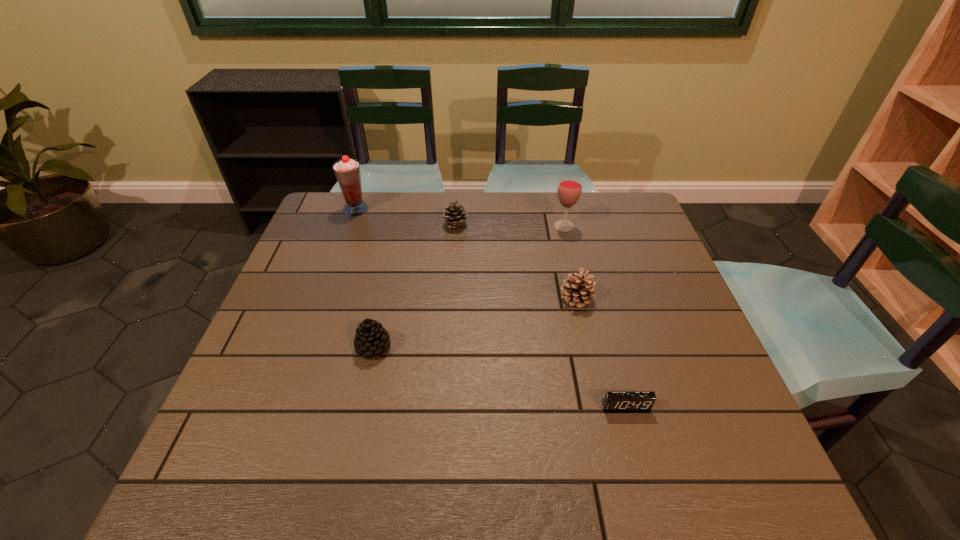
Locate which pinecone is the third closest to the tallest object. Please provide its 2D coordinates. Your answer should be formatted as a tuple, i.e. [(x, y)], where the tuple contains the x and y coordinates of a point satisfying the conditions above.

[(578, 289)]

At what (x,y) coordinates should I click in order to perform the action: click on free space that satisfies the following two spatial constraints: 1. on the front side of the tallest object; 2. on the right side of the rightmost pinecone. Please return your answer as a coordinate pair (x, y). Image resolution: width=960 pixels, height=540 pixels. Looking at the image, I should click on (324, 299).

Where is `vacant space that satisfies the following two spatial constraints: 1. on the front side of the wineglass; 2. on the right side of the farthest pinecone`? The width and height of the screenshot is (960, 540). vacant space that satisfies the following two spatial constraints: 1. on the front side of the wineglass; 2. on the right side of the farthest pinecone is located at coordinates (455, 226).